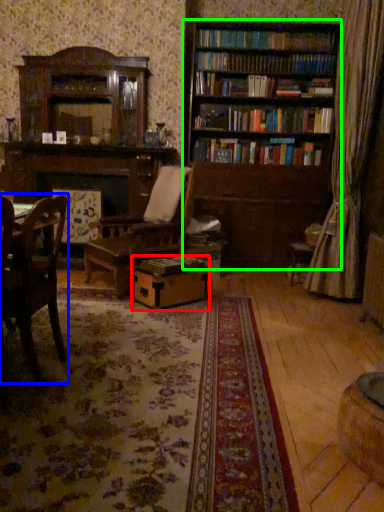
Question: Based on their relative distances, which object is farther from cardboard box (highlighted by a red box)? Choose from chair (highlighted by a blue box) and bookcase (highlighted by a green box).

Choices:
 (A) chair
 (B) bookcase

Answer: (B)